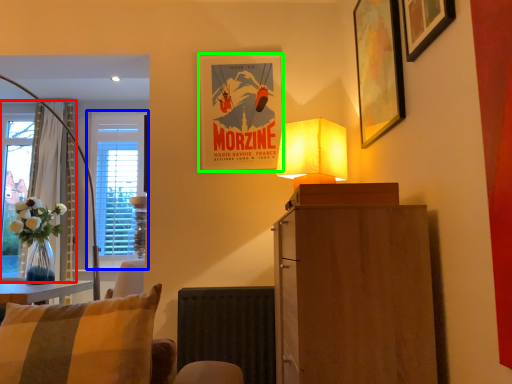
Question: Which object is the closest to the curtain (highlighted by a red box)? Choose among these: window (highlighted by a blue box) or picture frame (highlighted by a green box).

Choices:
 (A) window
 (B) picture frame

Answer: (A)